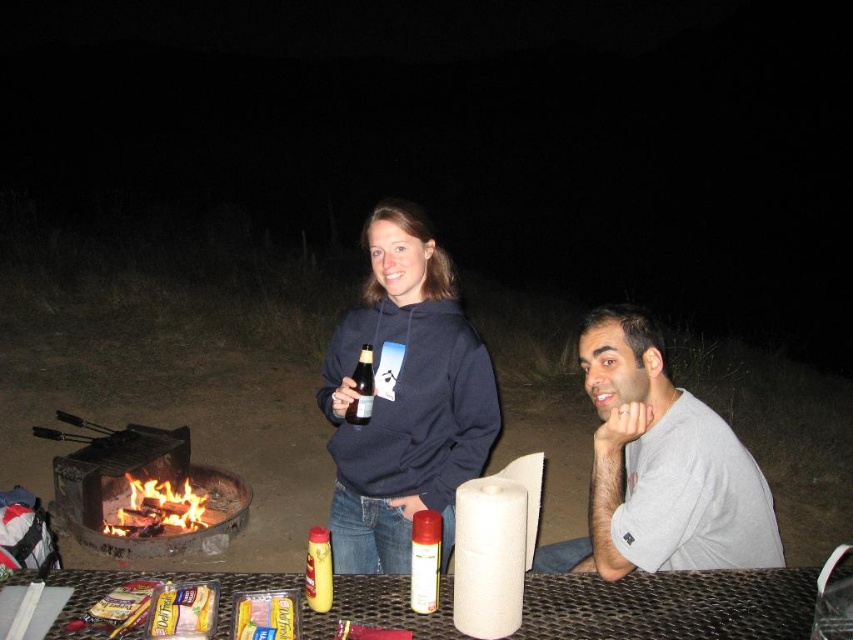
Can you confirm if matte blue hoodie at center is smaller than yellow plastic cheese at table center?

Incorrect, matte blue hoodie at center is not smaller in size than yellow plastic cheese at table center.

From the picture: Does matte blue hoodie at center have a larger size compared to yellow plastic cheese at table center?

Yes.

Describe the element at coordinates (404, 397) in the screenshot. I see `matte blue hoodie at center` at that location.

Where is `matte blue hoodie at center`? This screenshot has height=640, width=853. matte blue hoodie at center is located at coordinates (404, 397).

Does yellow plastic cheese at table center come in front of satin gold spray can at center?

Yes, it is in front of satin gold spray can at center.

Does yellow plastic cheese at table center have a greater width compared to satin gold spray can at center?

Yes.

Locate an element on the screen. This screenshot has width=853, height=640. yellow plastic cheese at table center is located at coordinates (265, 616).

Who is taller, gray cotton t-shirt at right or brick fire pit at lower left?

gray cotton t-shirt at right

Can you confirm if gray cotton t-shirt at right is positioned above brick fire pit at lower left?

Yes, gray cotton t-shirt at right is above brick fire pit at lower left.

Is point (663, 374) closer to viewer compared to point (109, 492)?

Yes, point (663, 374) is closer to viewer.

Find the location of a particular element. The height and width of the screenshot is (640, 853). gray cotton t-shirt at right is located at coordinates (660, 468).